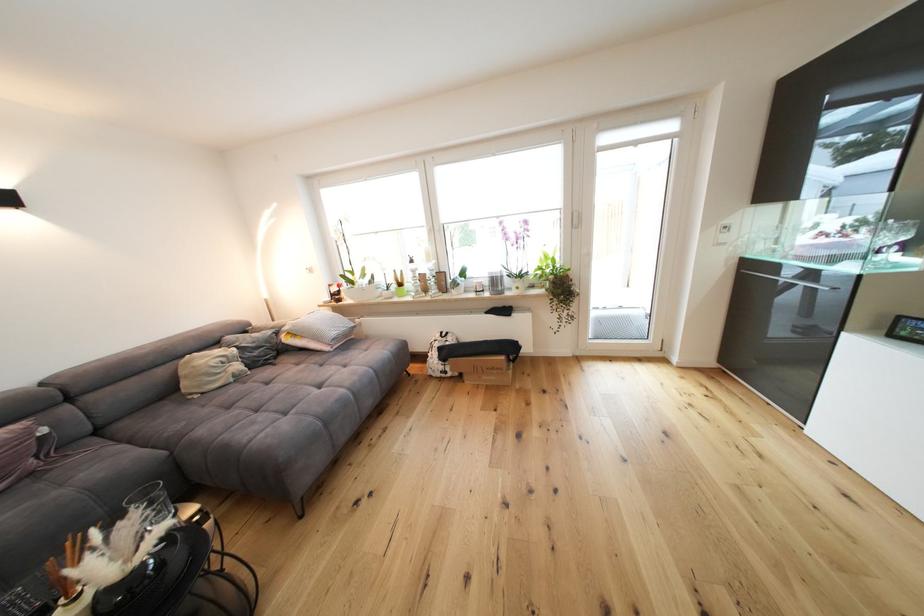
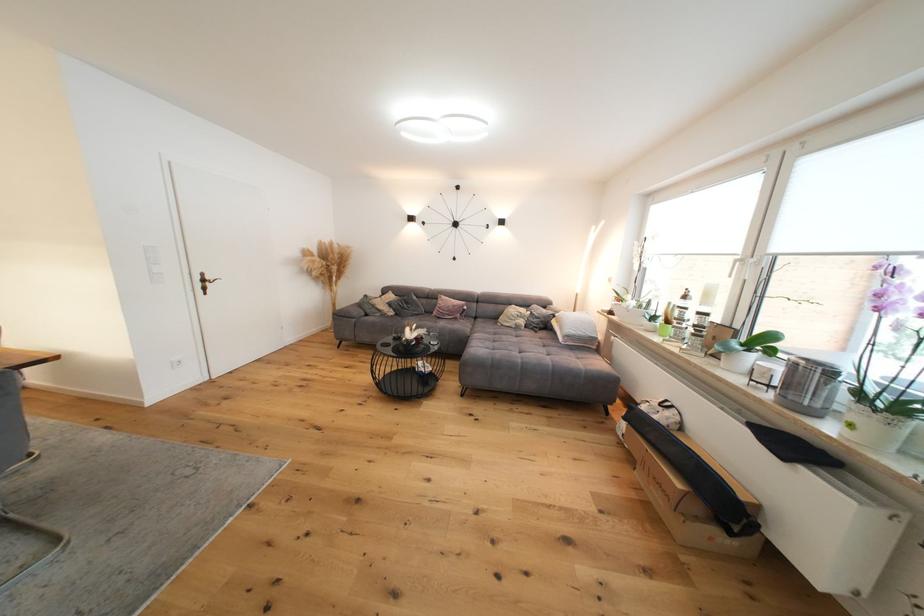
Question: I am providing you with two images of the same scene from different viewpoints. After the viewpoint changes to image2, which objects are now occluded?

Choices:
 (A) white flower pot
 (B) sofa armrest
 (C) dark door handle
 (D) none of these

Answer: (D)